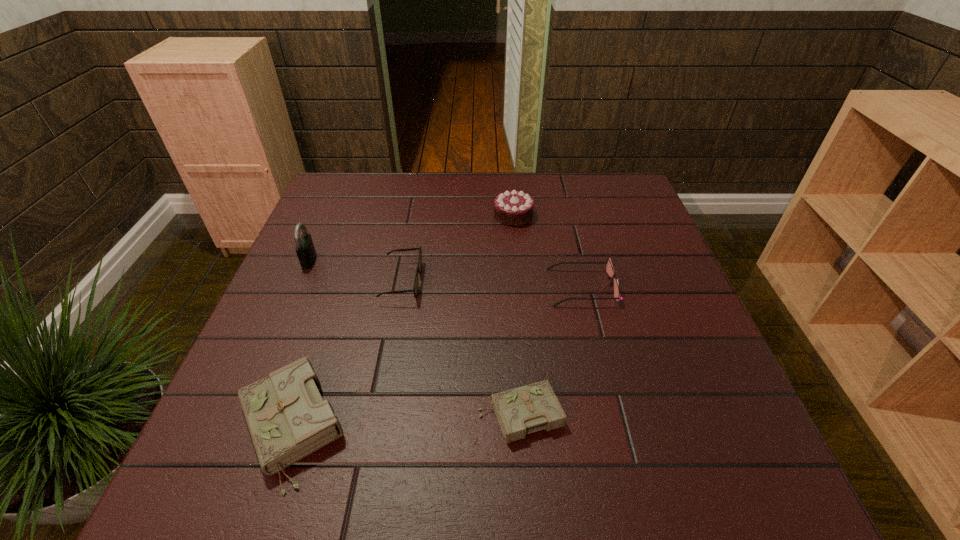
Find the location of `vacant region located on the front of the chocolate cake`. vacant region located on the front of the chocolate cake is located at coordinates (518, 272).

Identify the location of vacant area located on the front of the tallest object. The image size is (960, 540). (300, 284).

This screenshot has width=960, height=540. I want to click on vacant space located 0.160m on the bridge of the right sunglasses, so click(484, 287).

Where is `blank area located 0.250m on the bridge of the right sunglasses`? blank area located 0.250m on the bridge of the right sunglasses is located at coordinates point(446,287).

Locate an element on the screen. The height and width of the screenshot is (540, 960). vacant space located 0.070m on the bridge of the right sunglasses is located at coordinates (521, 287).

The width and height of the screenshot is (960, 540). I want to click on vacant space located on the front-facing side of the left sunglasses, so click(558, 281).

Locate an element on the screen. The width and height of the screenshot is (960, 540). object at the far edge is located at coordinates (513, 208).

Image resolution: width=960 pixels, height=540 pixels. In order to click on diary at the left edge in this screenshot , I will do `click(287, 418)`.

Find the location of a particular element. The image size is (960, 540). padlock at the left edge is located at coordinates (305, 250).

This screenshot has width=960, height=540. In order to click on object that is at the right edge in this screenshot , I will do `click(609, 268)`.